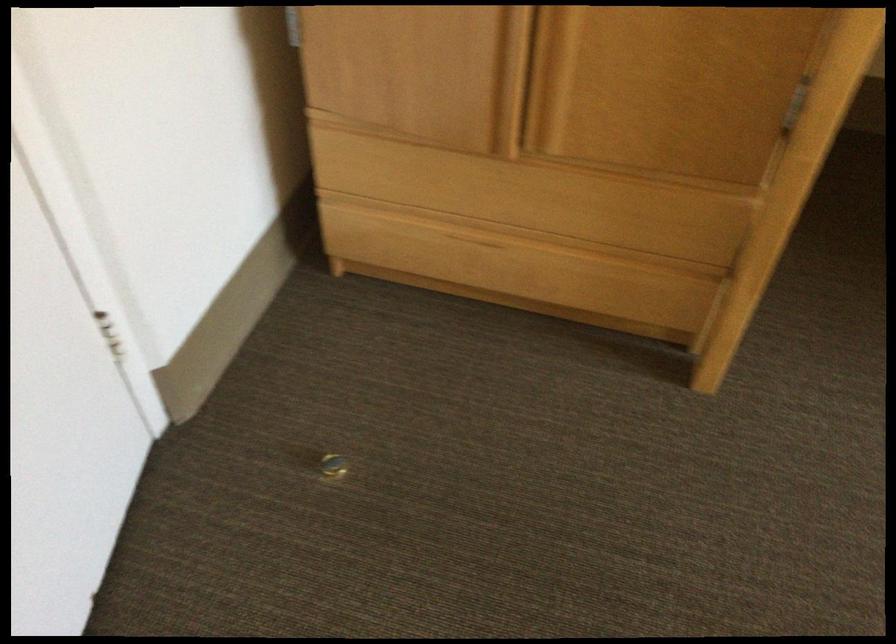
Where would you pull the top drawer handle? Please return your answer as a coordinate pair (x, y).

(521, 191)